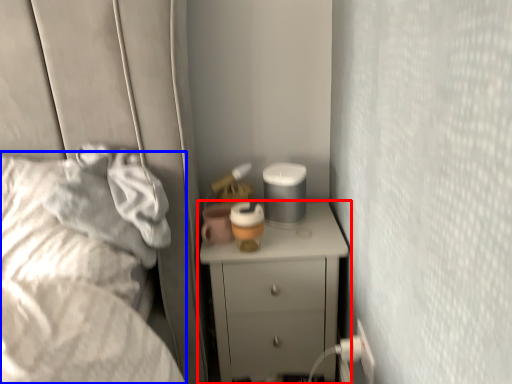
Question: Which of the following is the farthest to the observer, chest of drawers (highlighted by a red box) or bed (highlighted by a blue box)?

Choices:
 (A) chest of drawers
 (B) bed

Answer: (A)